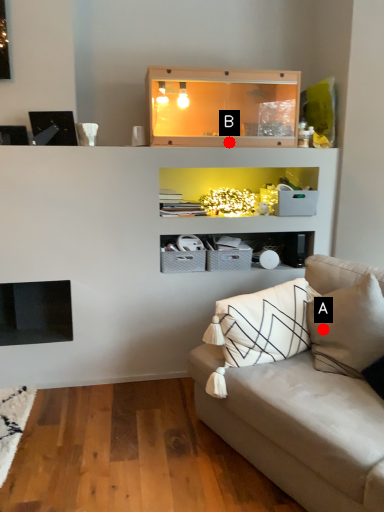
Question: Two points are circled on the image, labeled by A and B beside each circle. Which point is closer to the camera?

Choices:
 (A) A is closer
 (B) B is closer

Answer: (A)